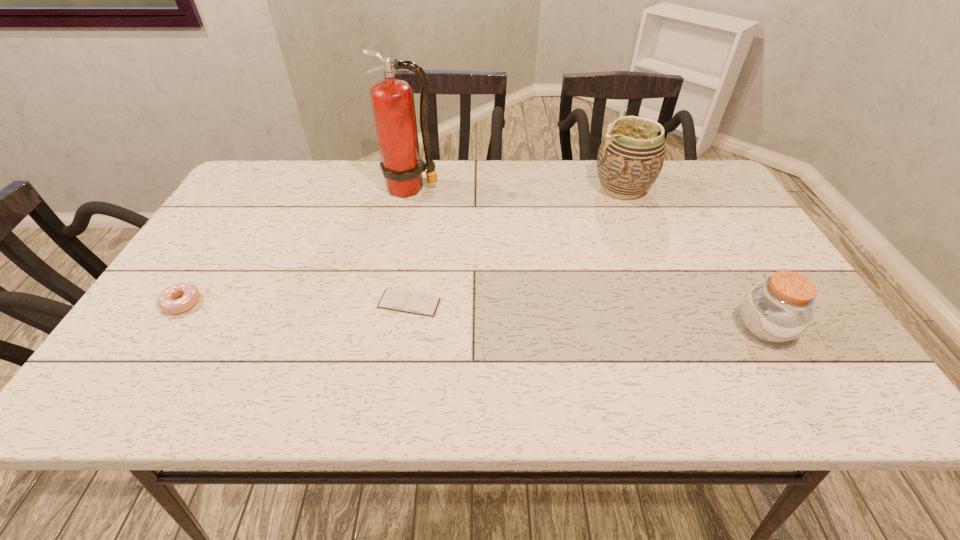
Where is `fire extinguisher`? fire extinguisher is located at coordinates (393, 105).

Where is `the second object from right to left`? The height and width of the screenshot is (540, 960). the second object from right to left is located at coordinates (630, 158).

This screenshot has width=960, height=540. In order to click on pottery in this screenshot , I will do `click(630, 158)`.

Where is `jar`? This screenshot has height=540, width=960. jar is located at coordinates (780, 309).

What are the coordinates of `the third shortest object` in the screenshot? It's located at (780, 309).

Locate an element on the screen. the fourth tallest object is located at coordinates (166, 301).

You are a GUI agent. You are given a task and a screenshot of the screen. Output one action in this format:
    pyautogui.click(x=<x>, y=<y>)
    Task: Click on the leftmost object
    The image size is (960, 540).
    Given the screenshot: What is the action you would take?
    pyautogui.click(x=166, y=301)

This screenshot has height=540, width=960. Identify the location of diary. (403, 300).

Identify the location of vacant space located 0.300m at the nozzle of the tallest object. The image size is (960, 540). (395, 272).

This screenshot has height=540, width=960. Identify the location of vacant area situated on the left of the second tallest object. (506, 190).